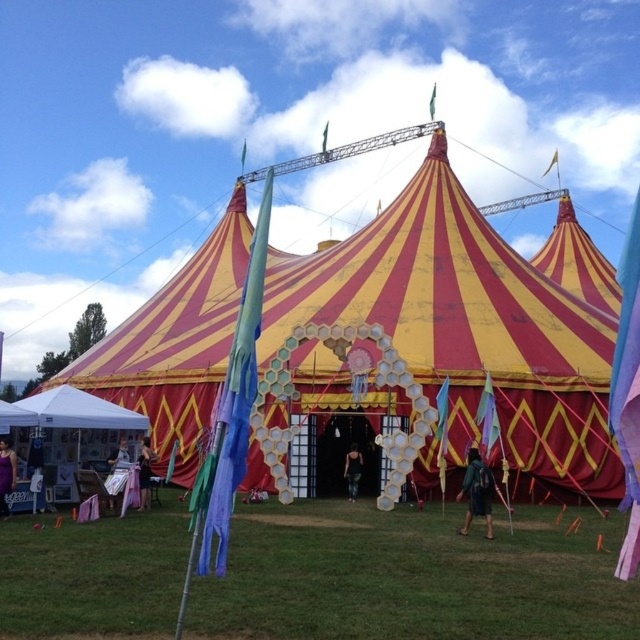
Is point (522, 612) more distant than point (481, 481)?

No, it is not.

What are the coordinates of `green grass at lower center` in the screenshot? It's located at (413, 577).

Locate an element on the screen. The height and width of the screenshot is (640, 640). green grass at lower center is located at coordinates (413, 577).

Is point (36, 588) closer to camera compared to point (8, 456)?

That is True.

Does point (490, 586) come farther from viewer compared to point (13, 452)?

That is False.

This screenshot has width=640, height=640. Find the location of `green grass at lower center`. green grass at lower center is located at coordinates (413, 577).

Which is more to the left, dark blue jeans at center or metallic silver chair at lower left?

metallic silver chair at lower left

Which of these two, dark blue jeans at center or metallic silver chair at lower left, stands shorter?

Standing shorter between the two is metallic silver chair at lower left.

Find the location of a particular element. The width and height of the screenshot is (640, 640). dark blue jeans at center is located at coordinates (353, 470).

Where is `dark blue jeans at center`? Image resolution: width=640 pixels, height=640 pixels. dark blue jeans at center is located at coordinates (353, 470).